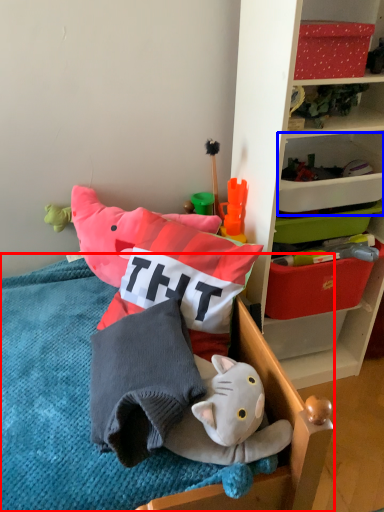
Question: Which of the following is the closest to the observer, furniture (highlighted by a red box) or storage box (highlighted by a blue box)?

Choices:
 (A) furniture
 (B) storage box

Answer: (A)